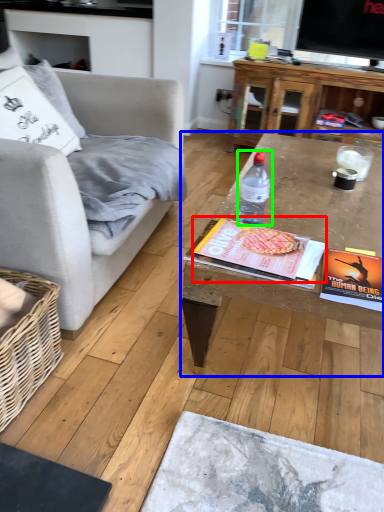
Question: Which object is positioned closest to magazine (highlighted by a red box)? Select from coffee table (highlighted by a blue box) and bottle (highlighted by a green box).

Choices:
 (A) coffee table
 (B) bottle

Answer: (B)